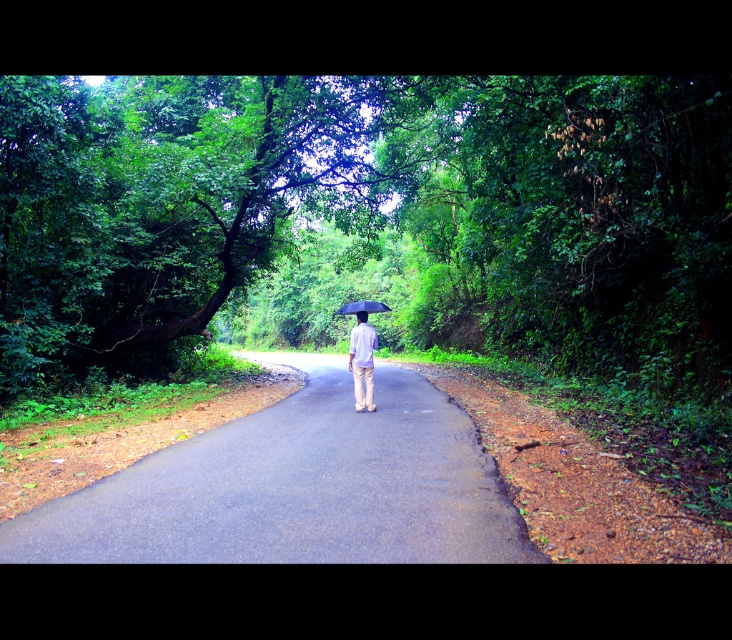
Question: Is light purple fabric umbrella at center positioned at the back of black matte umbrella at center?

Choices:
 (A) yes
 (B) no

Answer: (B)

Question: Which of these objects is positioned farthest from the black matte umbrella at center?

Choices:
 (A) light purple fabric umbrella at center
 (B) asphalt road at center

Answer: (A)

Question: Estimate the real-world distances between objects in this image. Which object is farther from the light purple fabric umbrella at center?

Choices:
 (A) black matte umbrella at center
 (B) asphalt road at center

Answer: (A)

Question: Which point is farther to the camera?

Choices:
 (A) asphalt road at center
 (B) light purple fabric umbrella at center

Answer: (B)

Question: Can you confirm if asphalt road at center is bigger than light purple fabric umbrella at center?

Choices:
 (A) yes
 (B) no

Answer: (A)

Question: Is light purple fabric umbrella at center further to the viewer compared to black matte umbrella at center?

Choices:
 (A) yes
 (B) no

Answer: (B)